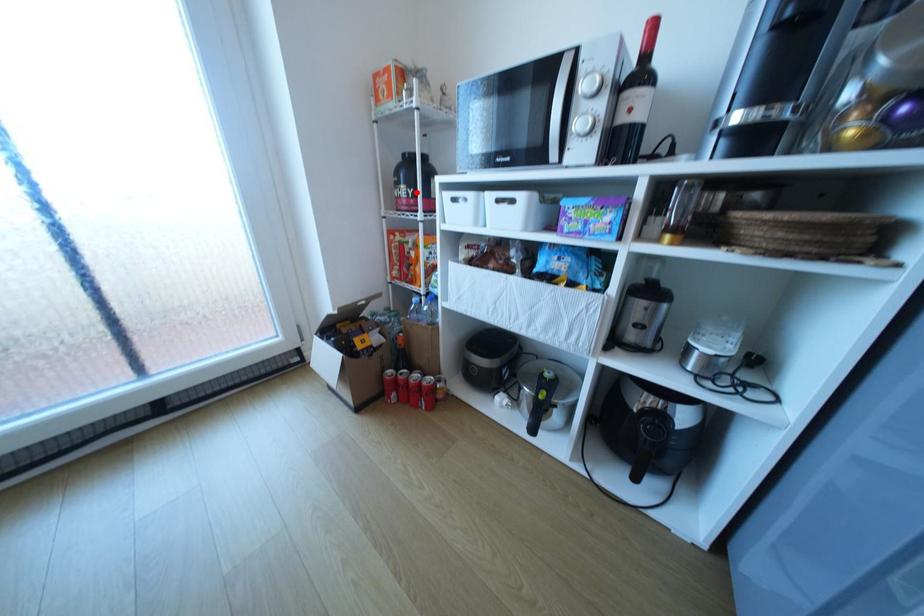
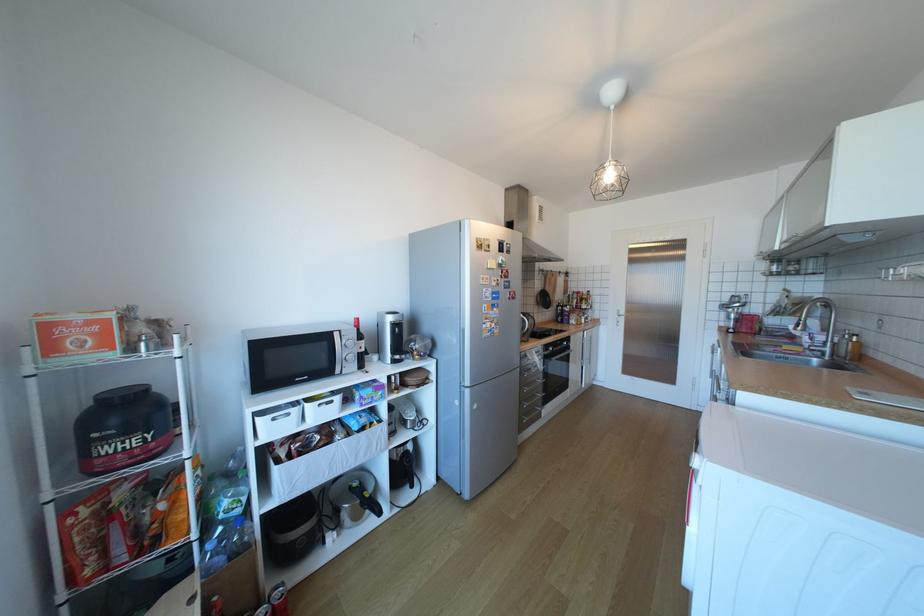
The point at the highlighted location is marked in the first image. Where is the corresponding point in the second image?

(152, 439)